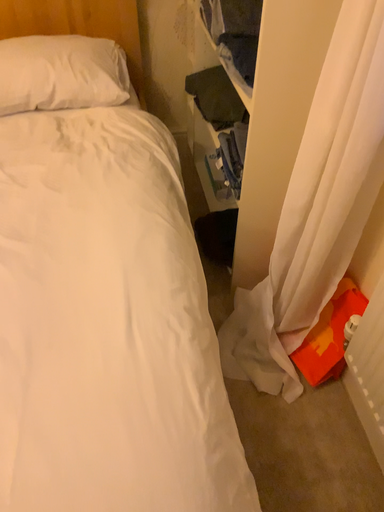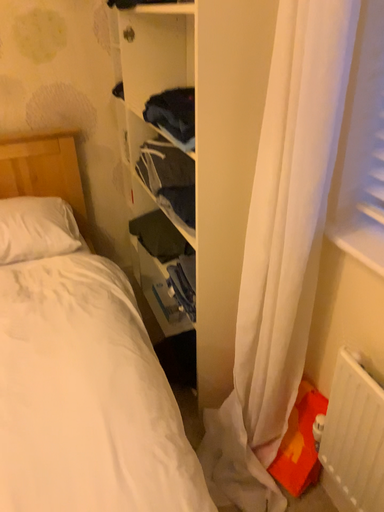
Question: How did the camera likely rotate when shooting the video?

Choices:
 (A) rotated downward
 (B) rotated upward

Answer: (B)